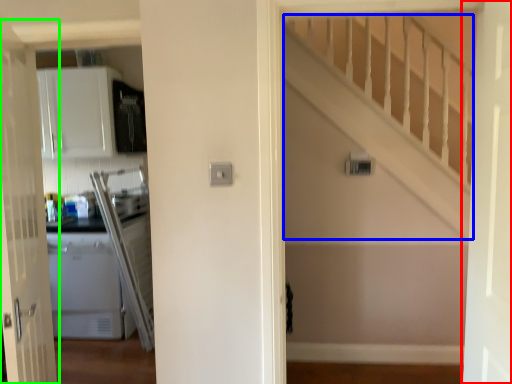
Question: Based on their relative distances, which object is nearer to door (highlighted by a red box)? Choose from stairwell (highlighted by a blue box) and door (highlighted by a green box).

Choices:
 (A) stairwell
 (B) door

Answer: (A)